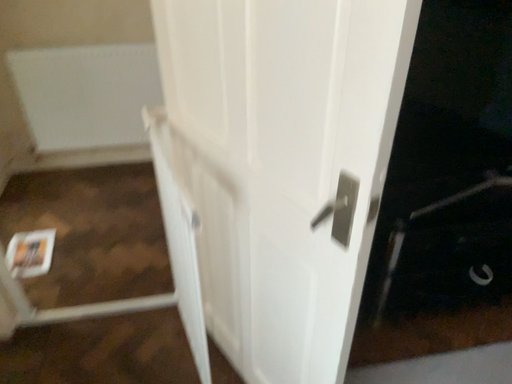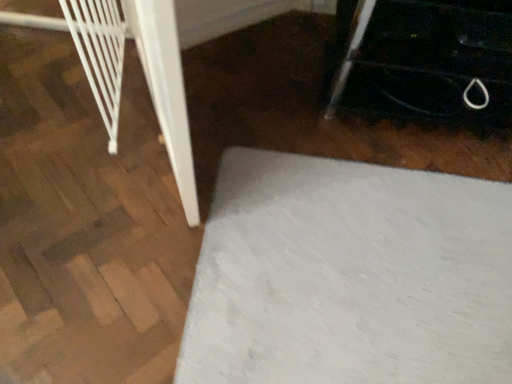
Question: How did the camera likely rotate when shooting the video?

Choices:
 (A) rotated downward
 (B) rotated upward

Answer: (A)